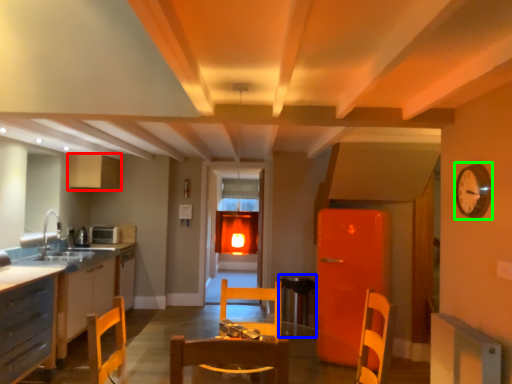
Question: Considering the real-world distances, which object is farthest from cabinetry (highlighted by a red box)? round table (highlighted by a blue box) or clock (highlighted by a green box)?

Choices:
 (A) round table
 (B) clock

Answer: (B)